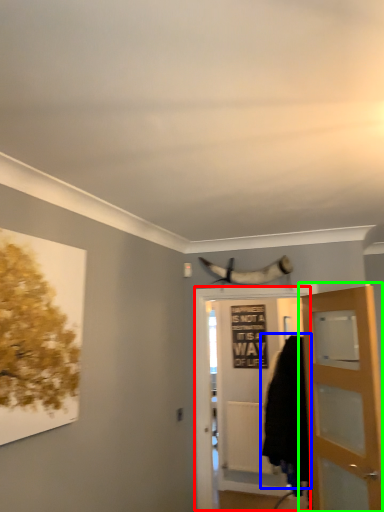
Question: Which object is positioned closest to door (highlighted by a red box)? Select from cloak (highlighted by a blue box) and door (highlighted by a green box).

Choices:
 (A) cloak
 (B) door

Answer: (A)